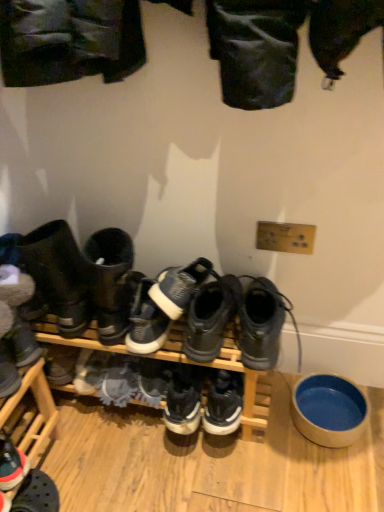
Question: Does white suede sneaker at lower left, which appears as the third footwear when viewed from the left, have a greater width compared to leather boots at left, the 2th footwear when ordered from left to right?

Choices:
 (A) yes
 (B) no

Answer: (B)

Question: Does white suede sneaker at lower left, which appears as the third footwear when viewed from the left, lie behind leather boots at left, the 2th footwear when ordered from left to right?

Choices:
 (A) no
 (B) yes

Answer: (B)

Question: Is white suede sneaker at lower left, which appears as the third footwear when viewed from the left, not close to leather boots at left, the 2th footwear when ordered from left to right?

Choices:
 (A) no
 (B) yes

Answer: (A)

Question: Considering the relative sizes of white suede sneaker at lower left, which appears as the third footwear when viewed from the left, and leather boots at left, which appears as the fifth footwear when viewed from the right, in the image provided, is white suede sneaker at lower left, which appears as the third footwear when viewed from the left, bigger than leather boots at left, which appears as the fifth footwear when viewed from the right,?

Choices:
 (A) yes
 (B) no

Answer: (B)

Question: Does white suede sneaker at lower left, which appears as the third footwear when viewed from the left, lie in front of leather boots at left, the 2th footwear when ordered from left to right?

Choices:
 (A) no
 (B) yes

Answer: (A)

Question: Visually, is white suede sneaker at lower left, which appears as the third footwear when viewed from the left, positioned to the left or to the right of blue ceramic bowl at lower right?

Choices:
 (A) right
 (B) left

Answer: (B)

Question: Is white suede sneaker at lower left, which is the 4th footwear from right to left, in front of or behind blue ceramic bowl at lower right in the image?

Choices:
 (A) behind
 (B) front

Answer: (A)

Question: Choose the correct answer: Is white suede sneaker at lower left, which is the 4th footwear from right to left, inside blue ceramic bowl at lower right or outside it?

Choices:
 (A) outside
 (B) inside

Answer: (A)

Question: In terms of width, does white suede sneaker at lower left, which appears as the third footwear when viewed from the left, look wider or thinner when compared to blue ceramic bowl at lower right?

Choices:
 (A) thin
 (B) wide

Answer: (A)

Question: From a real-world perspective, is reddish-brown leather sneaker at lower left, marked as the sixth footwear in a right-to-left arrangement, positioned above or below black mesh sneakers at center, acting as the 5th footwear starting from the left?

Choices:
 (A) below
 (B) above

Answer: (A)

Question: From the image's perspective, is reddish-brown leather sneaker at lower left, which is the 1th footwear in left-to-right order, positioned above or below black mesh sneakers at center, acting as the 5th footwear starting from the left?

Choices:
 (A) above
 (B) below

Answer: (B)

Question: In the image, is reddish-brown leather sneaker at lower left, marked as the sixth footwear in a right-to-left arrangement, positioned in front of or behind black mesh sneakers at center, acting as the 5th footwear starting from the left?

Choices:
 (A) behind
 (B) front

Answer: (A)

Question: In terms of width, does reddish-brown leather sneaker at lower left, which is the 1th footwear in left-to-right order, look wider or thinner when compared to black mesh sneakers at center, the 2th footwear from the right?

Choices:
 (A) wide
 (B) thin

Answer: (B)

Question: In the image, is blue ceramic bowl at lower right positioned in front of or behind white suede sneaker at center, the 3th footwear in the right-to-left sequence?

Choices:
 (A) front
 (B) behind

Answer: (B)

Question: In terms of size, does blue ceramic bowl at lower right appear bigger or smaller than white suede sneaker at center, placed as the 4th footwear when sorted from left to right?

Choices:
 (A) small
 (B) big

Answer: (B)